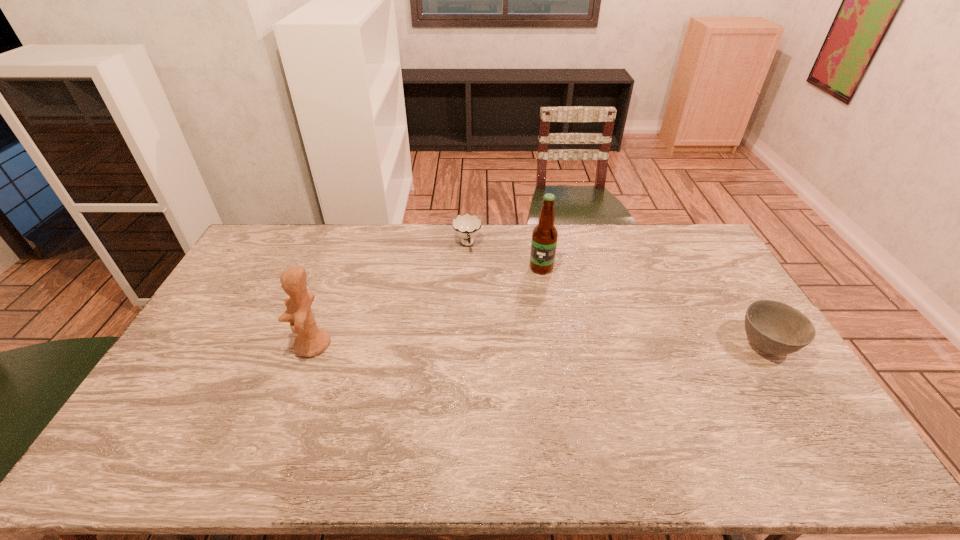
The width and height of the screenshot is (960, 540). Identify the location of vacant area that lies between the beer bottle and the figurine. (427, 306).

Locate an element on the screen. This screenshot has width=960, height=540. empty location between the bowl and the figurine is located at coordinates (540, 345).

Where is `vacant area between the leftmost object and the farthest object`? vacant area between the leftmost object and the farthest object is located at coordinates (390, 295).

The height and width of the screenshot is (540, 960). Identify the location of vacant point located between the rightmost object and the farthest object. (616, 295).

Locate an element on the screen. The image size is (960, 540). object that is the third nearest to the bowl is located at coordinates (311, 340).

Identify which object is located as the second nearest to the rightmost object. Please provide its 2D coordinates. Your answer should be formatted as a tuple, i.e. [(x, y)], where the tuple contains the x and y coordinates of a point satisfying the conditions above.

[(466, 226)]

The image size is (960, 540). Identify the location of free space in the image that satisfies the following two spatial constraints: 1. on the front side of the cup; 2. on the left side of the third object from left to right. tap(467, 268).